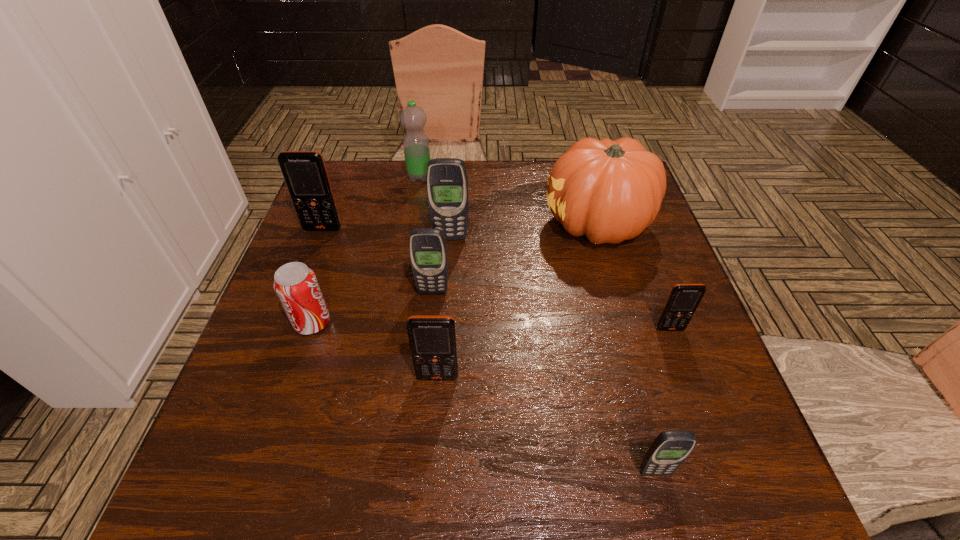
Image resolution: width=960 pixels, height=540 pixels. Identify the location of soda can that is at the left edge. (295, 284).

Find the location of `pumpkin that is at the right edge`. pumpkin that is at the right edge is located at coordinates (610, 191).

Where is `object located in the far right corner section of the desktop`? The height and width of the screenshot is (540, 960). object located in the far right corner section of the desktop is located at coordinates (610, 191).

This screenshot has width=960, height=540. What are the coordinates of `object that is at the near right corner` in the screenshot? It's located at (668, 451).

I want to click on vacant space at the far edge, so click(408, 188).

The width and height of the screenshot is (960, 540). Find the location of `free spot at the left edge of the desktop`. free spot at the left edge of the desktop is located at coordinates (277, 416).

Find the location of a particular element. The image size is (960, 540). free location at the right edge is located at coordinates (696, 341).

The width and height of the screenshot is (960, 540). In the image, there is a desktop. What are the coordinates of `free space at the far left corner` in the screenshot? It's located at (356, 180).

The image size is (960, 540). Identify the location of free spot at the near right corner of the desktop. (682, 475).

At what (x,y) coordinates should I click in order to perform the action: click on vacant space that's between the red soda can and the fifth farthest object. Please return your answer as a coordinate pair (x, y). Image resolution: width=960 pixels, height=540 pixels. Looking at the image, I should click on (372, 307).